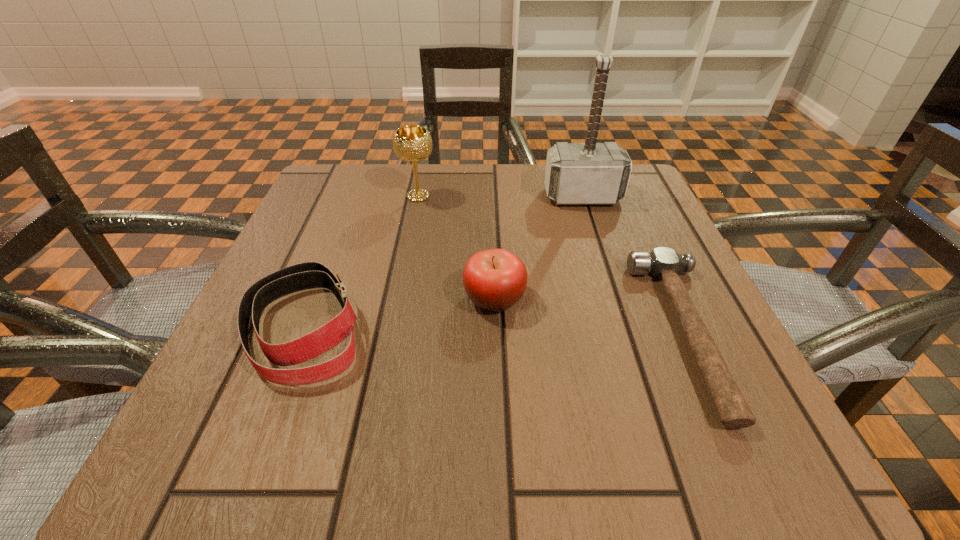
Where is `object positioned at the left edge`? object positioned at the left edge is located at coordinates (307, 275).

Image resolution: width=960 pixels, height=540 pixels. Identify the location of object at the far right corner. (590, 173).

The height and width of the screenshot is (540, 960). I want to click on object located at the near right corner, so click(664, 263).

This screenshot has height=540, width=960. In the image, there is a desktop. What are the coordinates of `vacant space at the far edge` in the screenshot? It's located at [x=531, y=198].

The image size is (960, 540). I want to click on free space at the near edge of the desktop, so click(354, 454).

The height and width of the screenshot is (540, 960). In order to click on vacant region at the left edge in this screenshot , I will do `click(337, 230)`.

At what (x,y) coordinates should I click in order to perform the action: click on vacant space at the right edge of the desktop. Please return your answer as a coordinate pair (x, y). The width and height of the screenshot is (960, 540). Looking at the image, I should click on pos(660,328).

Find the location of a particular element. This screenshot has height=540, width=960. vacant space at the far left corner is located at coordinates (364, 174).

In the image, there is a desktop. Identify the location of vacant region at the near right corner. The height and width of the screenshot is (540, 960). (708, 437).

This screenshot has width=960, height=540. I want to click on unoccupied area between the nearer hammer and the fourth object from right to left, so click(x=552, y=265).